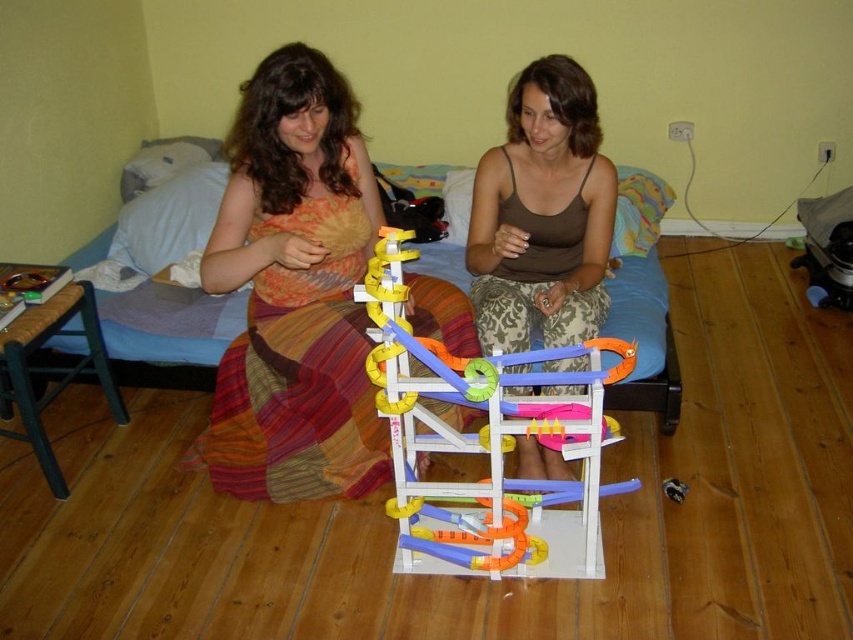
You are trying to place a new rug in the room. The blue fabric bed at center and the brown woven stool at left are in the way. Which object should you move first to access the floor space behind them?

The blue fabric bed at center is located above the brown woven stool at left, so you should move the brown woven stool at left first to access the floor space behind both objects.

You are standing at the entrance of the room and want to place a new lamp on the blue fabric bed at center. Based on the coordinates provided in the Objects Description, can you determine if the lamp will fit on the bed?

The blue fabric bed at center is located at coordinates point (167, 333), so the lamp can be placed there as the bed is a suitable surface for it.